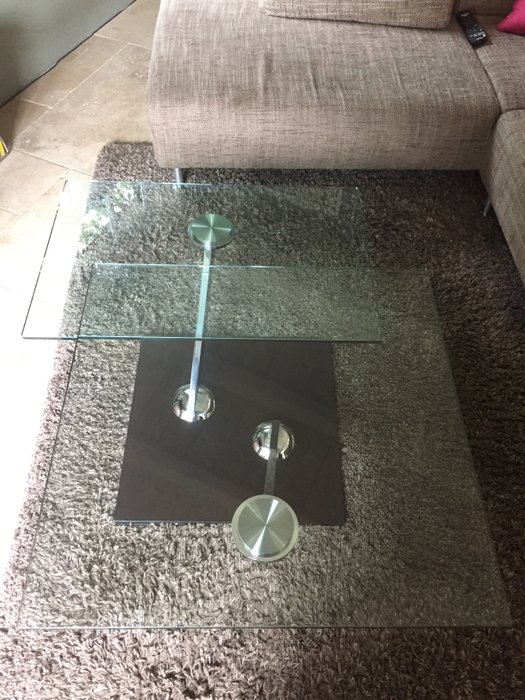
In order to click on brown shag rug in this screenshot , I will do `click(494, 358)`.